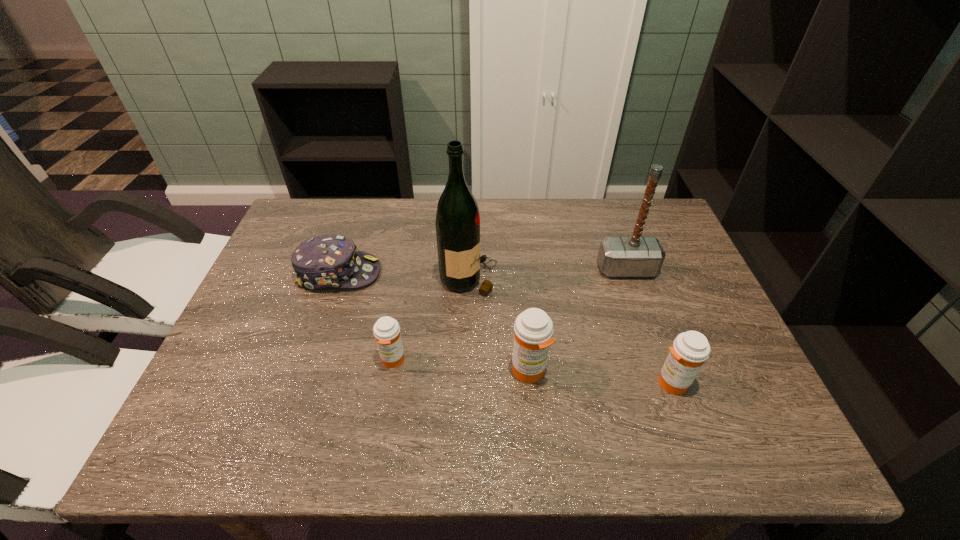
You are a GUI agent. You are given a task and a screenshot of the screen. Output one action in this format:
    pyautogui.click(x=<x>, y=<y>)
    Task: Click on the free space that is in between the second shortest object and the hammer
    Image resolution: width=960 pixels, height=540 pixels.
    Given the screenshot: What is the action you would take?
    pyautogui.click(x=510, y=315)

The width and height of the screenshot is (960, 540). Identify the location of free space between the shortest medicine and the leftmost object. (366, 316).

This screenshot has width=960, height=540. Find the location of `vacant region between the fourth tallest object and the hammer`. vacant region between the fourth tallest object and the hammer is located at coordinates (649, 326).

Where is `empty space between the rightmost medicine and the wine bottle`? empty space between the rightmost medicine and the wine bottle is located at coordinates (570, 330).

Find the location of a particular element. object identified as the second closest to the second medicine from right to left is located at coordinates click(x=690, y=349).

Identify the location of object that is the nearest to the second shortest medicine. This screenshot has height=540, width=960. (533, 329).

Locate an element on the screen. This screenshot has height=540, width=960. the closest medicine to the fourth object from left to right is located at coordinates (690, 349).

Identify which medicine is located as the second nearest to the hammer. Please provide its 2D coordinates. Your answer should be formatted as a tuple, i.e. [(x, y)], where the tuple contains the x and y coordinates of a point satisfying the conditions above.

[(533, 329)]

What are the coordinates of `free space that satisfies the following two spatial constraints: 1. on the front side of the rightmost medicine; 2. on the right side of the second shortest object` in the screenshot? It's located at point(389,382).

The width and height of the screenshot is (960, 540). I want to click on vacant region that satisfies the following two spatial constraints: 1. on the front-facing side of the rightmost medicine; 2. on the left side of the shortest object, so click(x=302, y=382).